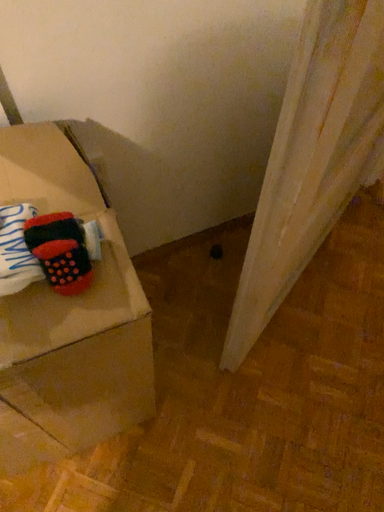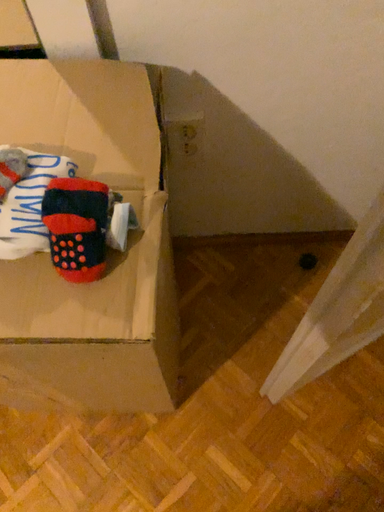
Question: Which way did the camera rotate in the video?

Choices:
 (A) rotated left
 (B) rotated right

Answer: (A)